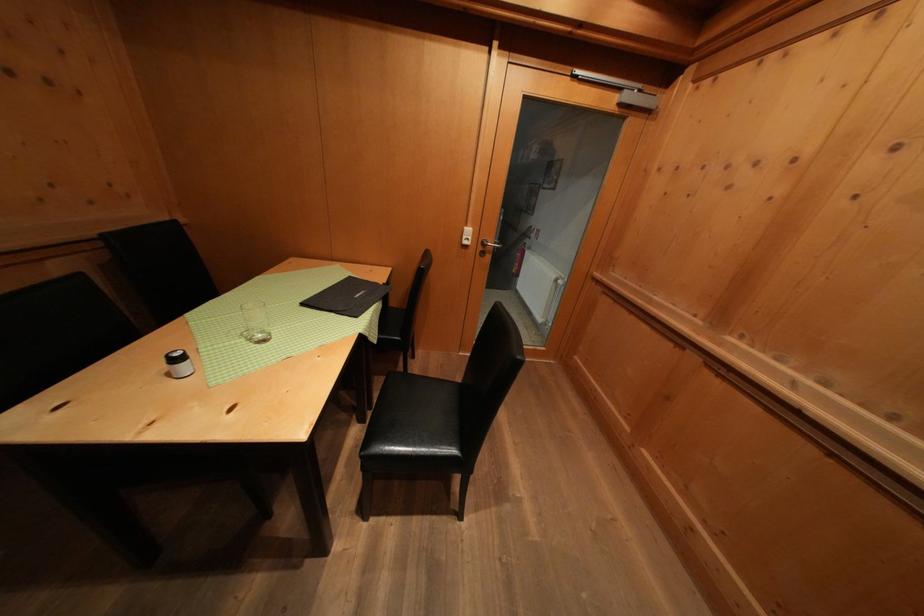
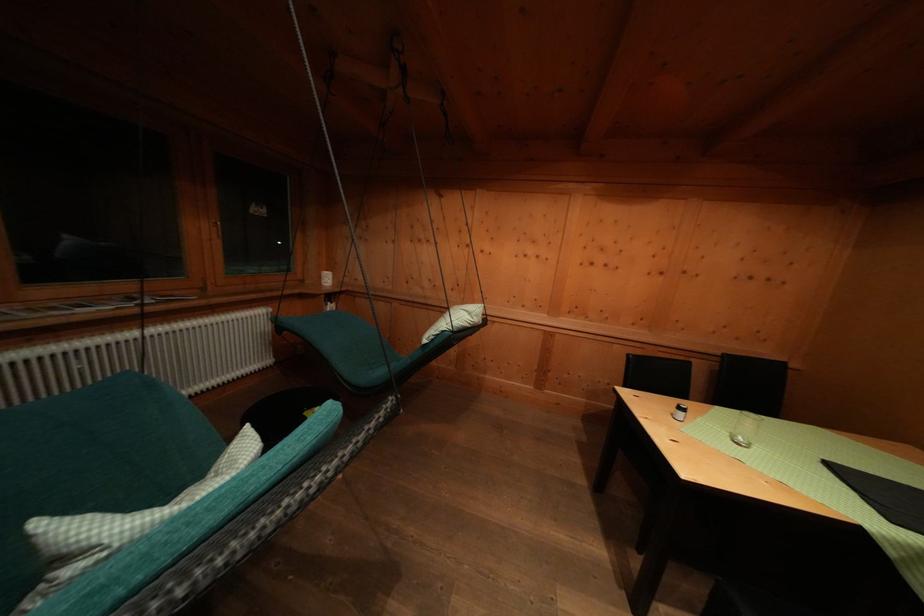
Question: The camera is either moving clockwise (left) or counter-clockwise (right) around the object. The first image is from the beginning of the video and the second image is from the end. Is the camera moving left or right when shooting the video?

Choices:
 (A) Left
 (B) Right

Answer: (B)